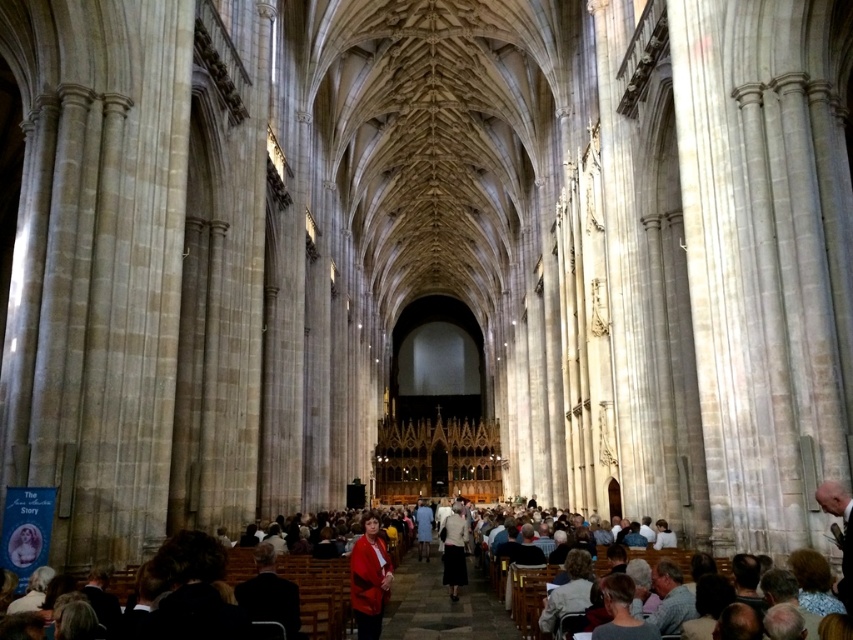
You are a photographer positioned at the back of the nave. You want to capture a photo of the congregation while ensuring both the matte red coat at center and the light beige skirt at center are clearly visible. Which object should you focus on first to ensure proper depth of field?

The matte red coat at center is smaller than the light beige skirt at center, so you should focus on the light beige skirt at center first because larger objects often require focusing on the main subject to ensure depth of field, but since both are at the same distance, focusing on the larger one might help in capturing details better.

You are a photographer planning to capture a closeup shot of the red fabric coat at center and the light beige skirt at center from the front row pew. Considering the cathedral has a strict no movement policy during the service, will you be able to take a clear photo of both items without moving from your current position?

The red fabric coat at center is larger in size than light beige skirt at center, so it might be easier to capture the red fabric coat at center in a clear photo from the front row pew. However, the light beige skirt at center may be harder to see due to its smaller size, but since both are at center, you might still be able to capture both if they are within your camera frame.